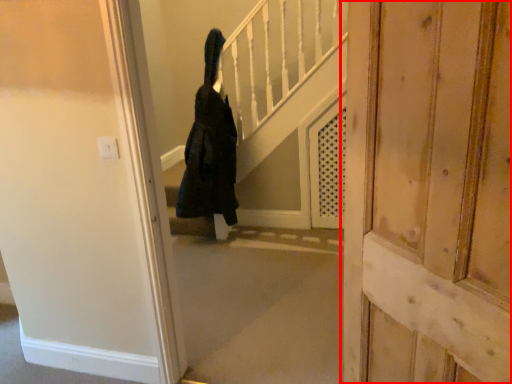
Question: In this image, where is door (annotated by the red box) located relative to person?

Choices:
 (A) left
 (B) right

Answer: (B)